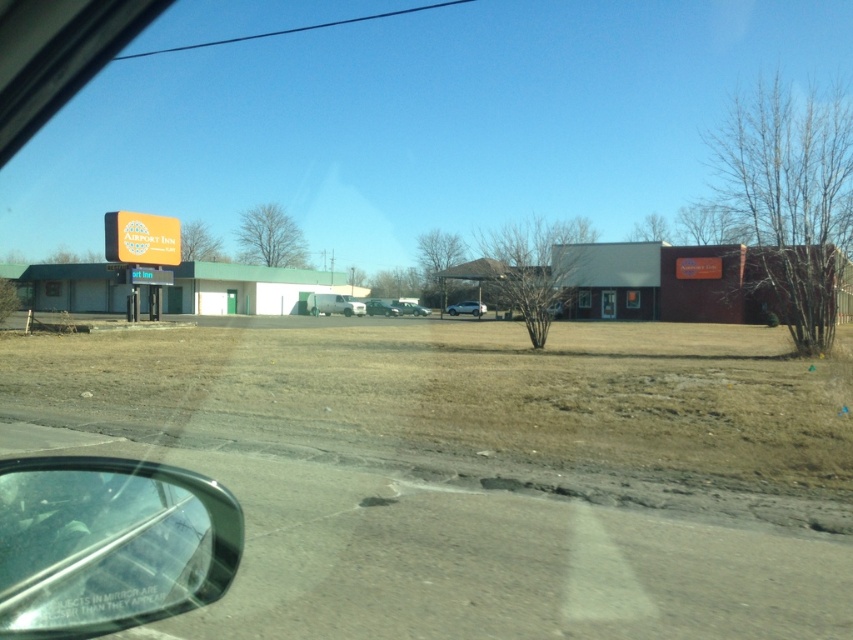
Does transparent glass car window at lower left have a smaller size compared to metallic silver car at center?

Yes, transparent glass car window at lower left is smaller than metallic silver car at center.

Where is `transparent glass car window at lower left`? The image size is (853, 640). transparent glass car window at lower left is located at coordinates (109, 545).

Can you confirm if white matte van at center is smaller than metallic silver car at center?

Correct, white matte van at center occupies less space than metallic silver car at center.

Is white matte van at center closer to the viewer compared to metallic silver car at center?

Yes, white matte van at center is closer to the viewer.

The image size is (853, 640). In order to click on white matte van at center in this screenshot , I will do `click(337, 305)`.

Does point (190, 339) lie in front of point (369, 300)?

Yes, it is in front of point (369, 300).

What do you see at coordinates (480, 394) in the screenshot? I see `brown dirt field at center` at bounding box center [480, 394].

What do you see at coordinates (480, 394) in the screenshot? The image size is (853, 640). I see `brown dirt field at center` at bounding box center [480, 394].

Locate an element on the screen. The image size is (853, 640). brown dirt field at center is located at coordinates (480, 394).